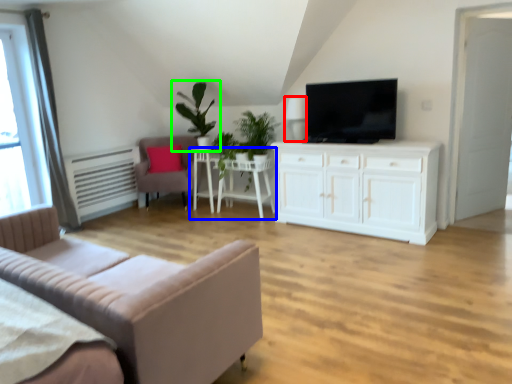
Question: Estimate the real-world distances between objects in this image. Which object is farther from lamp (highlighted by a red box), table (highlighted by a blue box) or houseplant (highlighted by a green box)?

Choices:
 (A) table
 (B) houseplant

Answer: (B)